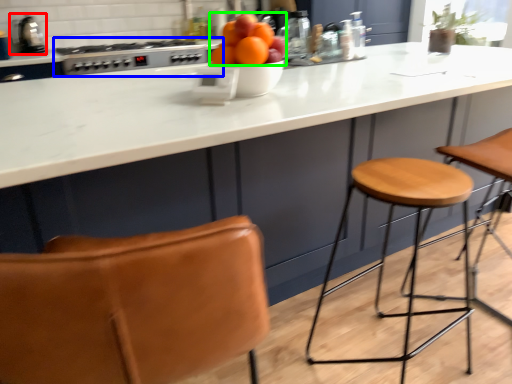
Question: Which object is the farthest from appliance (highlighted by a red box)? Choose among these: gas stove (highlighted by a blue box) or orange (highlighted by a green box).

Choices:
 (A) gas stove
 (B) orange

Answer: (B)